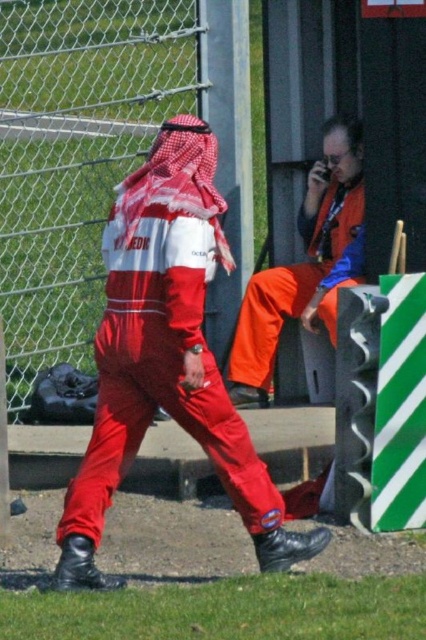
You are a photographer at a motorsport event. You need to capture a photo of the person in the matte red jumpsuit at center without including the person in the red and white racing suit walking away. Where should you position yourself relative to the point marked at coordinates (166, 356)?

Position yourself to the right of the point marked at (166, 356) to avoid including the person in the red and white racing suit walking away in the photo.